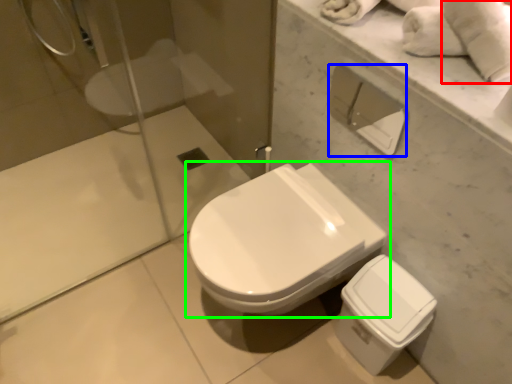
Question: Which object is positioned farthest from bath towel (highlighted by a red box)? Select from toilet paper (highlighted by a blue box) and toilet (highlighted by a green box).

Choices:
 (A) toilet paper
 (B) toilet

Answer: (A)